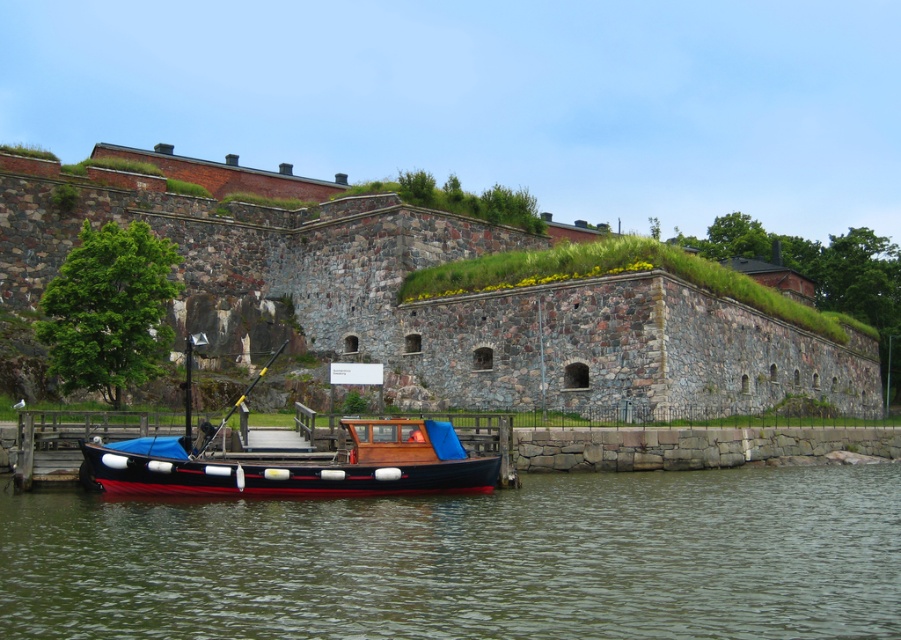
Question: Among these points, which one is nearest to the camera?

Choices:
 (A) [306, 588]
 (B) [630, 291]

Answer: (A)

Question: Does greenish water at lower center have a lesser width compared to wooden boat at lower left?

Choices:
 (A) yes
 (B) no

Answer: (B)

Question: Which object is closer to the camera taking this photo?

Choices:
 (A) stone wall at center
 (B) greenish water at lower center

Answer: (B)

Question: Can you confirm if greenish water at lower center is positioned to the left of wooden boat at lower left?

Choices:
 (A) no
 (B) yes

Answer: (A)

Question: Does stone wall at center have a larger size compared to wooden boat at lower left?

Choices:
 (A) no
 (B) yes

Answer: (B)

Question: Based on their relative distances, which object is nearer to the wooden boat at lower left?

Choices:
 (A) greenish water at lower center
 (B) stone wall at center

Answer: (A)